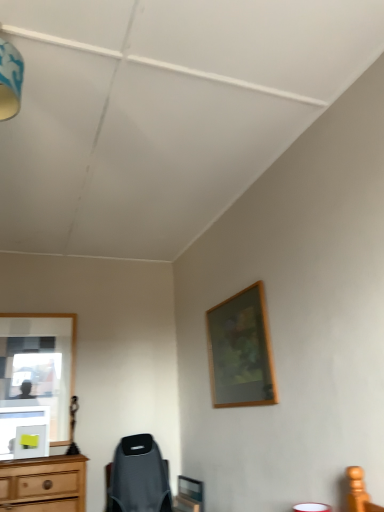
Describe the element at coordinates (10, 80) in the screenshot. I see `blue fabric lampshade at upper left` at that location.

Locate an element on the screen. This screenshot has height=512, width=384. blue fabric lampshade at upper left is located at coordinates (10, 80).

Measure the distance between blue fabric lampshade at upper left and camera.

The distance of blue fabric lampshade at upper left from camera is 1.44 meters.

What is the approximate height of blue fabric lampshade at upper left?

The height of blue fabric lampshade at upper left is 36.19 centimeters.

Image resolution: width=384 pixels, height=512 pixels. Describe the element at coordinates (241, 351) in the screenshot. I see `wooden picture frame at upper right` at that location.

Measure the distance between wooden picture frame at upper right and camera.

wooden picture frame at upper right and camera are 8.03 feet apart from each other.

Where is `wooden picture frame at upper right`? The image size is (384, 512). wooden picture frame at upper right is located at coordinates (241, 351).

The image size is (384, 512). Identify the location of blue fabric lampshade at upper left. (10, 80).

Considering the relative positions of blue fabric lampshade at upper left and wooden picture frame at upper right in the image provided, is blue fabric lampshade at upper left to the left of wooden picture frame at upper right from the viewer's perspective?

Correct, you'll find blue fabric lampshade at upper left to the left of wooden picture frame at upper right.

Is blue fabric lampshade at upper left positioned in front of wooden picture frame at upper right?

Yes.

Which is closer to the camera, (1,89) or (265,360)?

Point (1,89).

From the image's perspective, is blue fabric lampshade at upper left located beneath wooden picture frame at upper right?

No.

From a real-world perspective, is blue fabric lampshade at upper left below wooden picture frame at upper right?

Actually, blue fabric lampshade at upper left is physically above wooden picture frame at upper right in the real world.

Which of these two, blue fabric lampshade at upper left or wooden picture frame at upper right, is wider?

Wider between the two is blue fabric lampshade at upper left.

Can you confirm if blue fabric lampshade at upper left is taller than wooden picture frame at upper right?

Incorrect, the height of blue fabric lampshade at upper left is not larger of that of wooden picture frame at upper right.

Can you confirm if blue fabric lampshade at upper left is smaller than wooden picture frame at upper right?

Indeed, blue fabric lampshade at upper left has a smaller size compared to wooden picture frame at upper right.

Is wooden picture frame at upper right a part of blue fabric lampshade at upper left?

No, blue fabric lampshade at upper left does not contain wooden picture frame at upper right.

Is blue fabric lampshade at upper left beside wooden picture frame at upper right?

No, blue fabric lampshade at upper left is not with wooden picture frame at upper right.

Could you tell me if blue fabric lampshade at upper left is facing wooden picture frame at upper right?

No, blue fabric lampshade at upper left is not facing towards wooden picture frame at upper right.

Can you tell me how much blue fabric lampshade at upper left and wooden picture frame at upper right differ in facing direction?

The facing directions of blue fabric lampshade at upper left and wooden picture frame at upper right are 90 degrees apart.

Measure the distance from blue fabric lampshade at upper left to wooden picture frame at upper right.

1.97 meters.

Where is `light fixture in front of the wooden picture frame at upper right`? light fixture in front of the wooden picture frame at upper right is located at coordinates (10, 80).

Which object is positioned more to the left, wooden picture frame at upper right or blue fabric lampshade at upper left?

blue fabric lampshade at upper left.

Considering the positions of objects wooden picture frame at upper right and blue fabric lampshade at upper left in the image provided, who is in front, wooden picture frame at upper right or blue fabric lampshade at upper left?

blue fabric lampshade at upper left.

Is point (219, 331) in front of point (8, 95)?

No, it is not.

From the image's perspective, between wooden picture frame at upper right and blue fabric lampshade at upper left, who is located below?

wooden picture frame at upper right appears lower in the image.

Looking at this image, from a real-world perspective, is wooden picture frame at upper right located beneath blue fabric lampshade at upper left?

Yes.

Does wooden picture frame at upper right have a greater width compared to blue fabric lampshade at upper left?

Incorrect, the width of wooden picture frame at upper right does not surpass that of blue fabric lampshade at upper left.

Which of these two, wooden picture frame at upper right or blue fabric lampshade at upper left, stands taller?

Standing taller between the two is wooden picture frame at upper right.

Who is bigger, wooden picture frame at upper right or blue fabric lampshade at upper left?

wooden picture frame at upper right is bigger.

Is wooden picture frame at upper right inside the boundaries of blue fabric lampshade at upper left, or outside?

wooden picture frame at upper right exists outside the volume of blue fabric lampshade at upper left.

Is wooden picture frame at upper right beside blue fabric lampshade at upper left?

No, wooden picture frame at upper right is not making contact with blue fabric lampshade at upper left.

Could you tell me if wooden picture frame at upper right is facing blue fabric lampshade at upper left?

No, wooden picture frame at upper right does not turn towards blue fabric lampshade at upper left.

The height and width of the screenshot is (512, 384). I want to click on picture frame located underneath the blue fabric lampshade at upper left (from a real-world perspective), so click(x=241, y=351).

Locate an element on the screen. picture frame on the right of the blue fabric lampshade at upper left is located at coordinates (241, 351).

Where is `picture frame below the blue fabric lampshade at upper left (from a real-world perspective)`? This screenshot has width=384, height=512. picture frame below the blue fabric lampshade at upper left (from a real-world perspective) is located at coordinates (x=241, y=351).